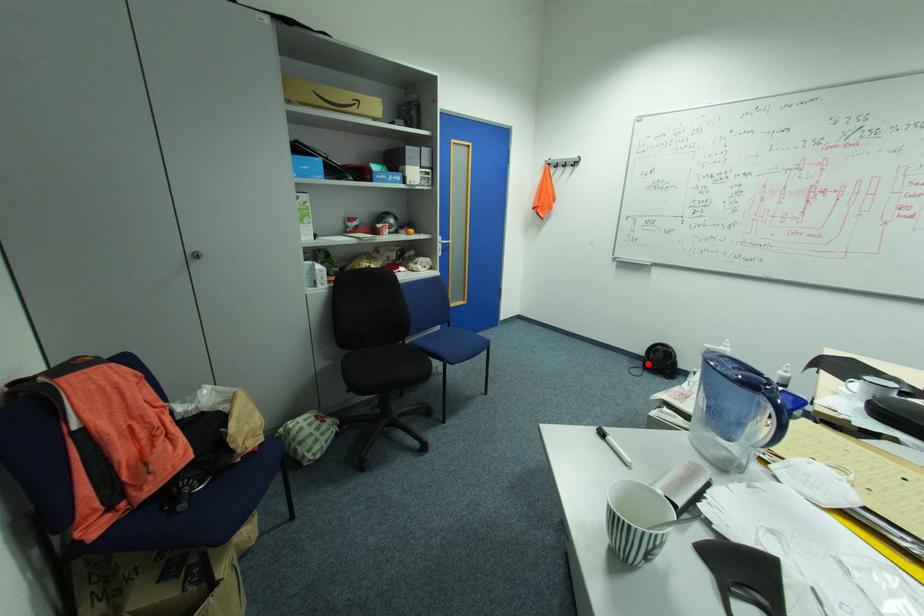
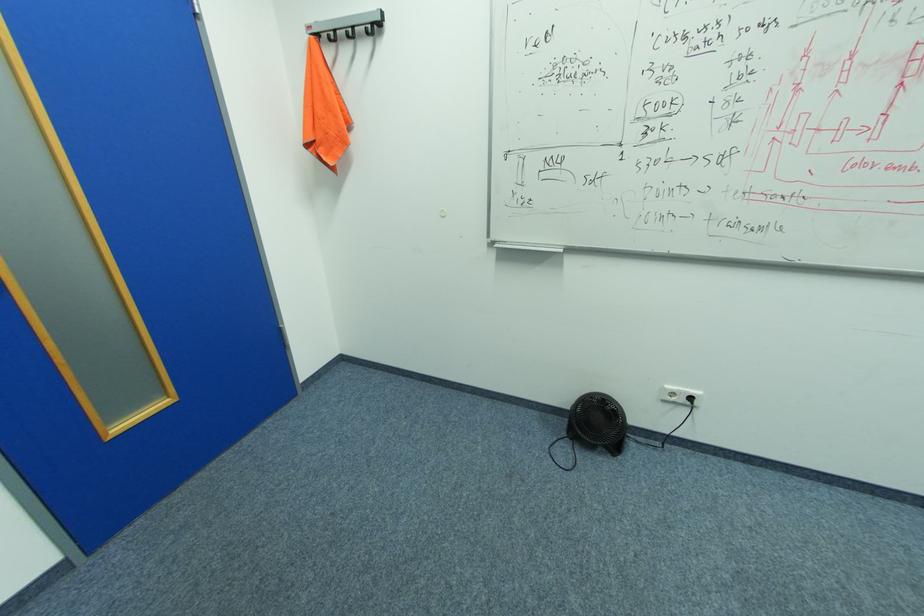
Question: I am providing you with two images of the same scene from different viewpoints. Given a red point in image1, look at the same physical point in image2. Is it:

Choices:
 (A) Closer to the viewpoint
 (B) Farther from the viewpoint

Answer: (B)